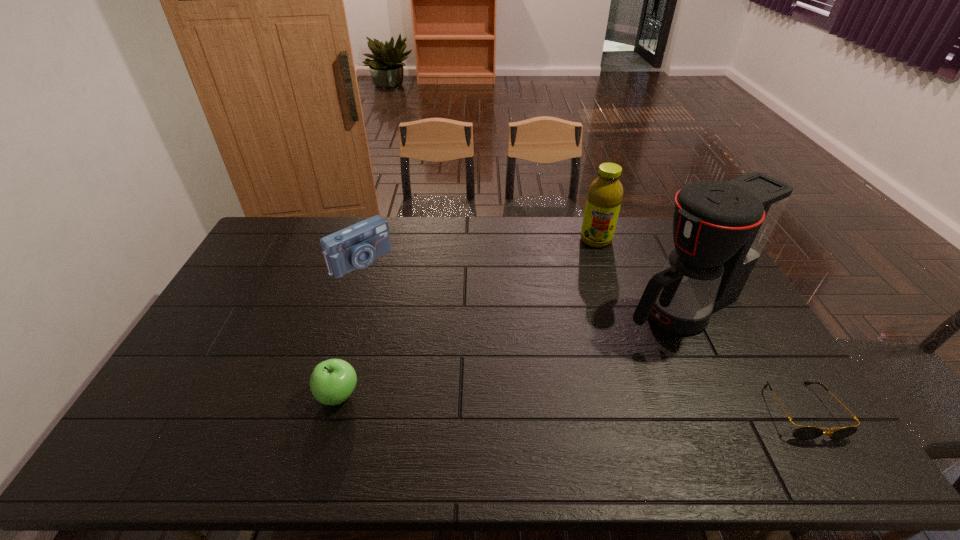
This screenshot has height=540, width=960. What are the coordinates of `free space located on the lens of the camera` in the screenshot? It's located at (394, 291).

I want to click on vacant point located on the lens of the camera, so click(398, 295).

Find the location of a particular element. vacant space located 0.340m on the lens of the camera is located at coordinates (436, 329).

I want to click on free region located 0.050m pour from the carafe of the third nearest object, so click(621, 329).

The width and height of the screenshot is (960, 540). I want to click on vacant space located pour from the carafe of the third nearest object, so click(x=609, y=335).

The image size is (960, 540). What are the coordinates of `free location located 0.300m pour from the carafe of the third nearest object` in the screenshot? It's located at tap(555, 362).

You are a GUI agent. You are given a task and a screenshot of the screen. Output one action in this format:
    pyautogui.click(x=<x>, y=<y>)
    Task: Click on the fruit juice that is at the far edge
    
    Given the screenshot: What is the action you would take?
    pyautogui.click(x=605, y=193)

The image size is (960, 540). What are the coordinates of `camera at the far edge` in the screenshot? It's located at (356, 247).

Locate an element on the screen. Image resolution: width=960 pixels, height=540 pixels. apple present at the near edge is located at coordinates (332, 381).

Image resolution: width=960 pixels, height=540 pixels. I want to click on sunglasses that is at the near edge, so (x=804, y=432).